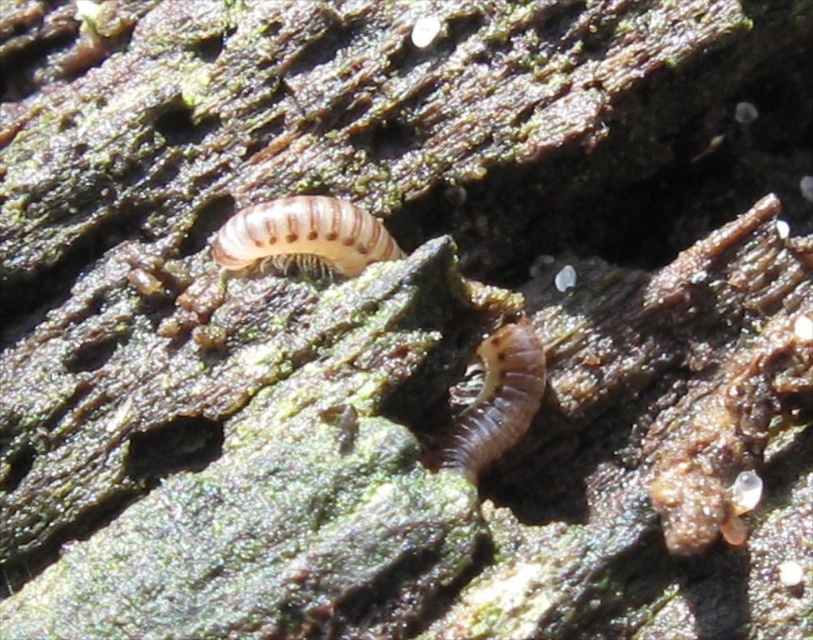
From the picture: Who is shorter, light brown striped millipede at center or brown matte worm at center?

light brown striped millipede at center

Is light brown striped millipede at center to the left of brown matte worm at center from the viewer's perspective?

Indeed, light brown striped millipede at center is positioned on the left side of brown matte worm at center.

Who is more distant from viewer, (229, 269) or (518, 360)?

The point (229, 269) is more distant.

You are a GUI agent. You are given a task and a screenshot of the screen. Output one action in this format:
    pyautogui.click(x=<x>, y=<y>)
    Task: Click on the light brown striped millipede at center
    The image size is (813, 640).
    Given the screenshot: What is the action you would take?
    coord(303,236)